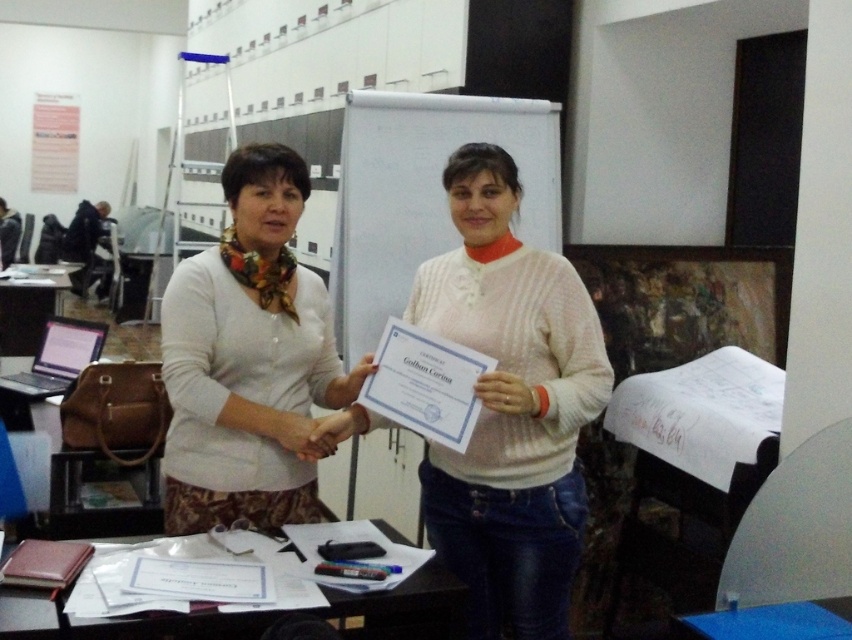
Question: In this image, where is white knitted sweater at center located relative to blue plastic table at lower center?

Choices:
 (A) above
 (B) below

Answer: (A)

Question: Which object appears closest to the camera in this image?

Choices:
 (A) white matte sweater at center
 (B) white paper at lower center

Answer: (B)

Question: Is white matte sweater at center positioned before blue plastic table at lower center?

Choices:
 (A) yes
 (B) no

Answer: (B)

Question: Which of the following is the farthest from the observer?

Choices:
 (A) white paper at lower center
 (B) white knitted sweater at center
 (C) white matte sweater at center
 (D) blue plastic table at lower center

Answer: (C)

Question: Is white knitted sweater at center positioned before white paper at lower center?

Choices:
 (A) no
 (B) yes

Answer: (A)

Question: Which object appears closest to the camera in this image?

Choices:
 (A) white matte sweater at center
 (B) white knitted sweater at center
 (C) blue plastic table at lower center
 (D) white paper at lower center

Answer: (D)